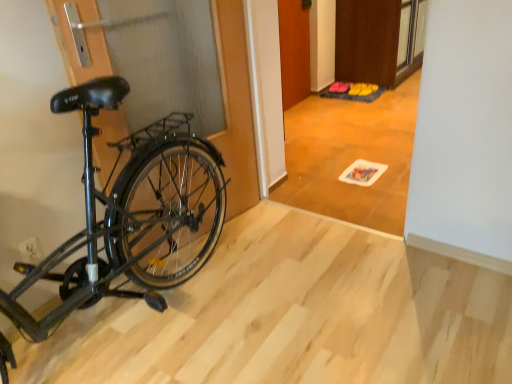
Where is `vacant area that is in front of yellow fabric walking shoe at center, the 2th walking shoe viewed from the left`? vacant area that is in front of yellow fabric walking shoe at center, the 2th walking shoe viewed from the left is located at coordinates (372, 96).